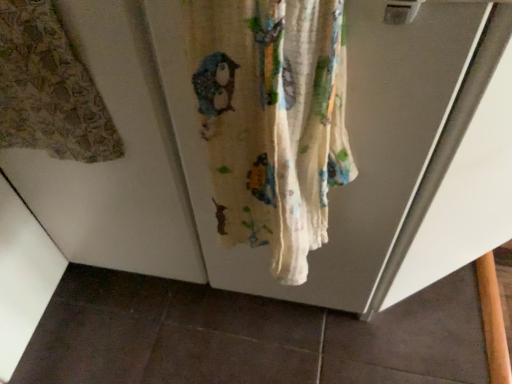
Where is `printed fabric curtain at left, which is the 1th curtain in left-to-right order`? Image resolution: width=512 pixels, height=384 pixels. printed fabric curtain at left, which is the 1th curtain in left-to-right order is located at coordinates (49, 89).

The height and width of the screenshot is (384, 512). Describe the element at coordinates (49, 89) in the screenshot. I see `printed fabric curtain at left, the second curtain from the right` at that location.

Image resolution: width=512 pixels, height=384 pixels. I want to click on white cotton curtain at center, placed as the 1th curtain when sorted from right to left, so click(271, 120).

This screenshot has width=512, height=384. Describe the element at coordinates (271, 120) in the screenshot. I see `white cotton curtain at center, marked as the 2th curtain in a left-to-right arrangement` at that location.

This screenshot has height=384, width=512. I want to click on printed fabric curtain at left, which is the 1th curtain in left-to-right order, so click(x=49, y=89).

Would you say white cotton curtain at center, placed as the 1th curtain when sorted from right to left, is to the left or to the right of printed fabric curtain at left, the second curtain from the right, in the picture?

Clearly, white cotton curtain at center, placed as the 1th curtain when sorted from right to left, is on the right of printed fabric curtain at left, the second curtain from the right, in the image.

Is the position of white cotton curtain at center, placed as the 1th curtain when sorted from right to left, more distant than that of printed fabric curtain at left, which is the 1th curtain in left-to-right order?

No.

Is point (220, 177) less distant than point (114, 151)?

Yes, point (220, 177) is closer to viewer.

Looking at this image, from the image's perspective, is white cotton curtain at center, marked as the 2th curtain in a left-to-right arrangement, above or below printed fabric curtain at left, the second curtain from the right?

From the image's perspective, white cotton curtain at center, marked as the 2th curtain in a left-to-right arrangement, appears below printed fabric curtain at left, the second curtain from the right.

From a real-world perspective, which is physically below, white cotton curtain at center, placed as the 1th curtain when sorted from right to left, or printed fabric curtain at left, the second curtain from the right?

white cotton curtain at center, placed as the 1th curtain when sorted from right to left, is physically lower.

Which object is thinner, white cotton curtain at center, marked as the 2th curtain in a left-to-right arrangement, or printed fabric curtain at left, the second curtain from the right?

printed fabric curtain at left, the second curtain from the right.

Who is shorter, white cotton curtain at center, marked as the 2th curtain in a left-to-right arrangement, or printed fabric curtain at left, which is the 1th curtain in left-to-right order?

Standing shorter between the two is white cotton curtain at center, marked as the 2th curtain in a left-to-right arrangement.

Looking at the image, does white cotton curtain at center, marked as the 2th curtain in a left-to-right arrangement, seem bigger or smaller compared to printed fabric curtain at left, the second curtain from the right?

In the image, white cotton curtain at center, marked as the 2th curtain in a left-to-right arrangement, appears to be larger than printed fabric curtain at left, the second curtain from the right.

Is white cotton curtain at center, marked as the 2th curtain in a left-to-right arrangement, inside or outside of printed fabric curtain at left, which is the 1th curtain in left-to-right order?

white cotton curtain at center, marked as the 2th curtain in a left-to-right arrangement, cannot be found inside printed fabric curtain at left, which is the 1th curtain in left-to-right order.

Are white cotton curtain at center, placed as the 1th curtain when sorted from right to left, and printed fabric curtain at left, the second curtain from the right, making contact?

No, white cotton curtain at center, placed as the 1th curtain when sorted from right to left, is not touching printed fabric curtain at left, the second curtain from the right.

Is white cotton curtain at center, marked as the 2th curtain in a left-to-right arrangement, aimed at printed fabric curtain at left, the second curtain from the right?

No, white cotton curtain at center, marked as the 2th curtain in a left-to-right arrangement, is not turned towards printed fabric curtain at left, the second curtain from the right.

How many degrees apart are the facing directions of white cotton curtain at center, placed as the 1th curtain when sorted from right to left, and printed fabric curtain at left, which is the 1th curtain in left-to-right order?

The facing directions of white cotton curtain at center, placed as the 1th curtain when sorted from right to left, and printed fabric curtain at left, which is the 1th curtain in left-to-right order, are 0.00312 degrees apart.

Find the location of `curtain below the printed fabric curtain at left, which is the 1th curtain in left-to-right order (from the image's perspective)`. curtain below the printed fabric curtain at left, which is the 1th curtain in left-to-right order (from the image's perspective) is located at coordinates (271, 120).

Considering the relative positions of printed fabric curtain at left, the second curtain from the right, and white cotton curtain at center, marked as the 2th curtain in a left-to-right arrangement, in the image provided, is printed fabric curtain at left, the second curtain from the right, to the left of white cotton curtain at center, marked as the 2th curtain in a left-to-right arrangement, from the viewer's perspective?

Yes, printed fabric curtain at left, the second curtain from the right, is to the left of white cotton curtain at center, marked as the 2th curtain in a left-to-right arrangement.

Which object is further away from the camera, printed fabric curtain at left, which is the 1th curtain in left-to-right order, or white cotton curtain at center, placed as the 1th curtain when sorted from right to left?

printed fabric curtain at left, which is the 1th curtain in left-to-right order, is further from the camera.

Considering the points (5, 33) and (229, 142), which point is in front, point (5, 33) or point (229, 142)?

The point (229, 142) is more forward.

From the image's perspective, is printed fabric curtain at left, the second curtain from the right, under white cotton curtain at center, marked as the 2th curtain in a left-to-right arrangement?

No, from the image's perspective, printed fabric curtain at left, the second curtain from the right, is not beneath white cotton curtain at center, marked as the 2th curtain in a left-to-right arrangement.

From a real-world perspective, who is located lower, printed fabric curtain at left, the second curtain from the right, or white cotton curtain at center, placed as the 1th curtain when sorted from right to left?

white cotton curtain at center, placed as the 1th curtain when sorted from right to left.

Which object is wider, printed fabric curtain at left, which is the 1th curtain in left-to-right order, or white cotton curtain at center, placed as the 1th curtain when sorted from right to left?

white cotton curtain at center, placed as the 1th curtain when sorted from right to left, is wider.

Does printed fabric curtain at left, which is the 1th curtain in left-to-right order, have a lesser height compared to white cotton curtain at center, placed as the 1th curtain when sorted from right to left?

No.

Which of these two, printed fabric curtain at left, which is the 1th curtain in left-to-right order, or white cotton curtain at center, placed as the 1th curtain when sorted from right to left, is smaller?

printed fabric curtain at left, which is the 1th curtain in left-to-right order.

Is printed fabric curtain at left, the second curtain from the right, completely or partially outside of white cotton curtain at center, placed as the 1th curtain when sorted from right to left?

Yes.

Is printed fabric curtain at left, which is the 1th curtain in left-to-right order, not near white cotton curtain at center, marked as the 2th curtain in a left-to-right arrangement?

No, there isn't a large distance between printed fabric curtain at left, which is the 1th curtain in left-to-right order, and white cotton curtain at center, marked as the 2th curtain in a left-to-right arrangement.

Is printed fabric curtain at left, the second curtain from the right, positioned with its back to white cotton curtain at center, marked as the 2th curtain in a left-to-right arrangement?

No.

How many degrees apart are the facing directions of printed fabric curtain at left, which is the 1th curtain in left-to-right order, and white cotton curtain at center, placed as the 1th curtain when sorted from right to left?

There is a 0.00312-degree angle between the facing directions of printed fabric curtain at left, which is the 1th curtain in left-to-right order, and white cotton curtain at center, placed as the 1th curtain when sorted from right to left.

How much distance is there between printed fabric curtain at left, which is the 1th curtain in left-to-right order, and white cotton curtain at center, marked as the 2th curtain in a left-to-right arrangement?

A distance of 8.95 inches exists between printed fabric curtain at left, which is the 1th curtain in left-to-right order, and white cotton curtain at center, marked as the 2th curtain in a left-to-right arrangement.

Locate an element on the screen. The height and width of the screenshot is (384, 512). curtain behind the white cotton curtain at center, placed as the 1th curtain when sorted from right to left is located at coordinates (49, 89).

What are the coordinates of `curtain below the printed fabric curtain at left, the second curtain from the right (from a real-world perspective)` in the screenshot? It's located at (271, 120).

Identify the location of curtain behind the white cotton curtain at center, marked as the 2th curtain in a left-to-right arrangement. This screenshot has height=384, width=512. (49, 89).